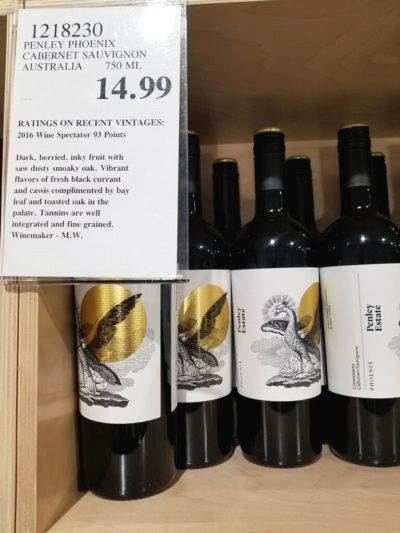
This screenshot has height=533, width=400. In order to click on wooden cabinet in this screenshot , I will do `click(257, 500)`.